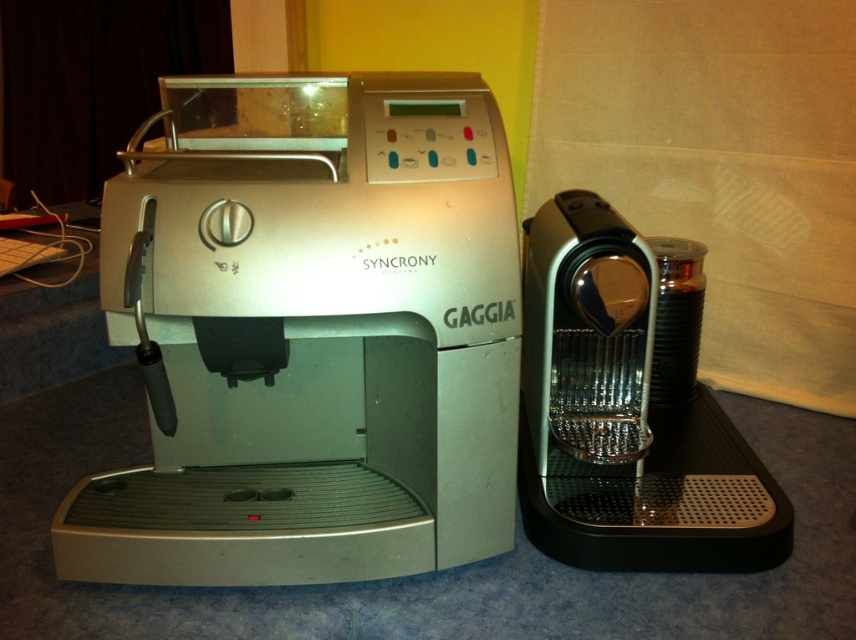
You are a barista who needs to place a 12cm diameter tray between the silver metallic espresso machine at left and the metallic silver coffee machine at right. Can you fit it there?

The silver metallic espresso machine at left is larger than the metallic silver coffee machine at right, so the space between them may be sufficient to fit a 12cm diameter tray. However, without knowing the exact distance between them, it is difficult to confirm. Please check the available space.

You are standing at the center of the countertop and want to reach the silver metallic espresso machine at left. What direction should you move in?

Since the silver metallic espresso machine at left is positioned at point (311, 333), you should move to the left from your current position at the center of the countertop to reach it.